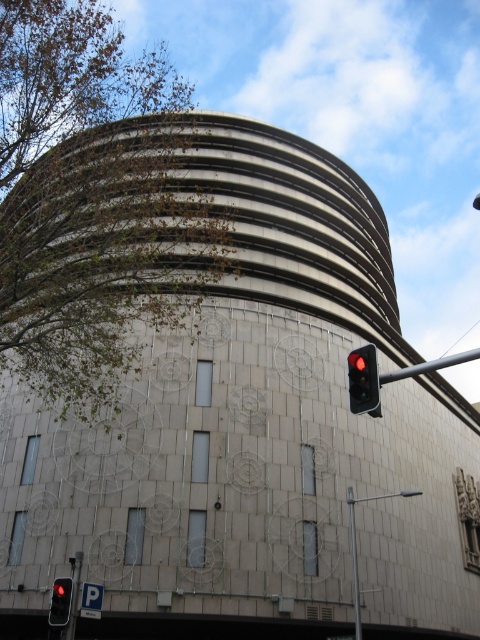
Does red plastic traffic light at right have a lesser width compared to metallic pole at right?

Correct, red plastic traffic light at right's width is less than metallic pole at right's.

In the scene shown: Who is more forward, (369, 372) or (432, 364)?

Positioned in front is point (432, 364).

The height and width of the screenshot is (640, 480). What do you see at coordinates (363, 380) in the screenshot? I see `red plastic traffic light at right` at bounding box center [363, 380].

Locate an element on the screen. Image resolution: width=480 pixels, height=640 pixels. red plastic traffic light at right is located at coordinates (363, 380).

Between metallic pole at right and red glass traffic light at lower left, which one appears on the right side from the viewer's perspective?

metallic pole at right

Locate an element on the screen. The height and width of the screenshot is (640, 480). metallic pole at right is located at coordinates (430, 365).

Between red plastic traffic light at right and red glass traffic light at lower left, which one has less height?

red glass traffic light at lower left is shorter.

Does point (368, 385) come behind point (52, 614)?

No, it is not.

Locate an element on the screen. Image resolution: width=480 pixels, height=640 pixels. red plastic traffic light at right is located at coordinates (363, 380).